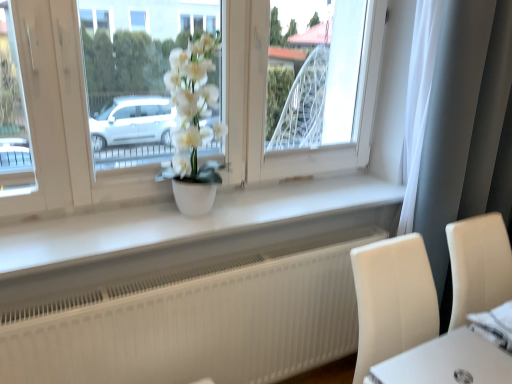
Identify the location of vacant space to the right of white matte pot at center. (257, 210).